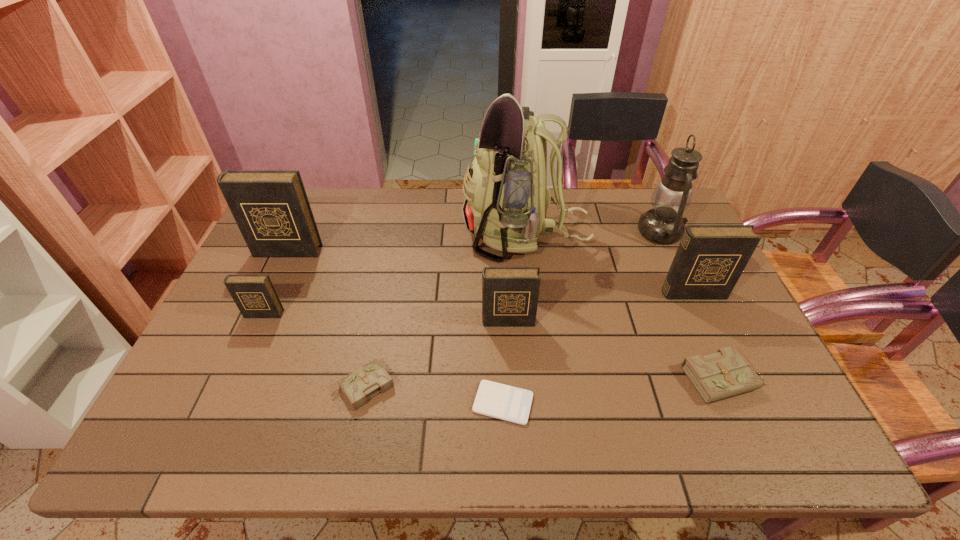
I want to click on backpack, so click(506, 197).

Identify the location of oil lamp. (663, 224).

You are a GUI agent. You are given a task and a screenshot of the screen. Output one action in this format:
    pyautogui.click(x=<x>, y=<y>)
    Task: Click on the biggest dark diary
    The width and height of the screenshot is (960, 540).
    Given the screenshot: What is the action you would take?
    pyautogui.click(x=271, y=208)

Find the location of a particular element. Image resolution: width=960 pixels, height=540 pixels. the farthest diary is located at coordinates (271, 208).

You are a GUI agent. You are given a task and a screenshot of the screen. Output one action in this format:
    pyautogui.click(x=<x>, y=<y>)
    Task: Click on the third smallest dark diary
    
    Given the screenshot: What is the action you would take?
    pyautogui.click(x=710, y=259)

I want to click on the rightmost dark diary, so (x=710, y=259).

Locate an element on the screen. the second smallest dark diary is located at coordinates (510, 295).

Locate an element on the screen. This screenshot has height=540, width=960. the third diary from right to left is located at coordinates (510, 295).

You are a GUI agent. You are given a task and a screenshot of the screen. Output one action in this format:
    pyautogui.click(x=<x>, y=<y>)
    Task: Click on the smallest dark diary
    The image size is (960, 540).
    Given the screenshot: What is the action you would take?
    pyautogui.click(x=255, y=296)

At what (x,y) coordinates should I click in order to perform the action: click on the third shortest diary. Please return your answer as a coordinate pair (x, y). This screenshot has width=960, height=540. Looking at the image, I should click on (255, 296).